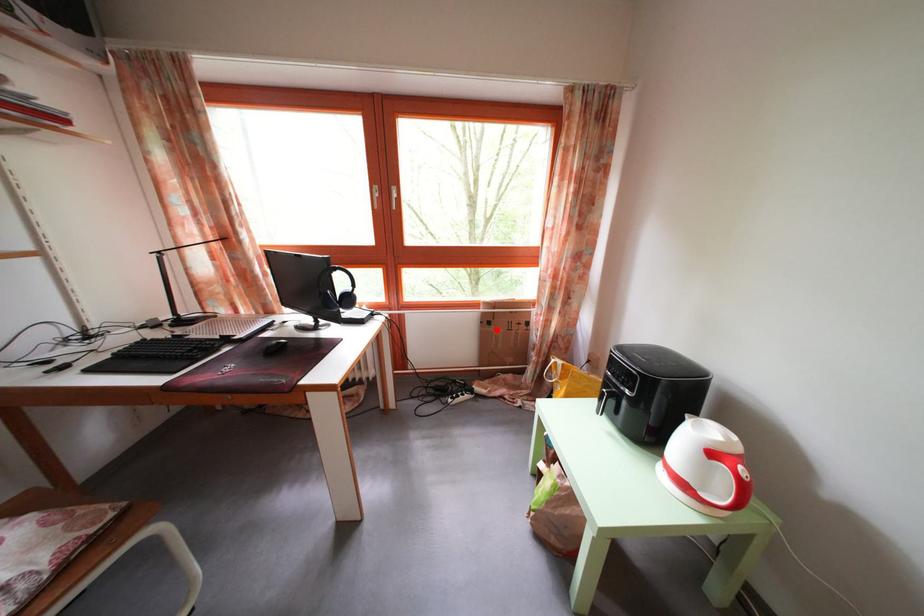
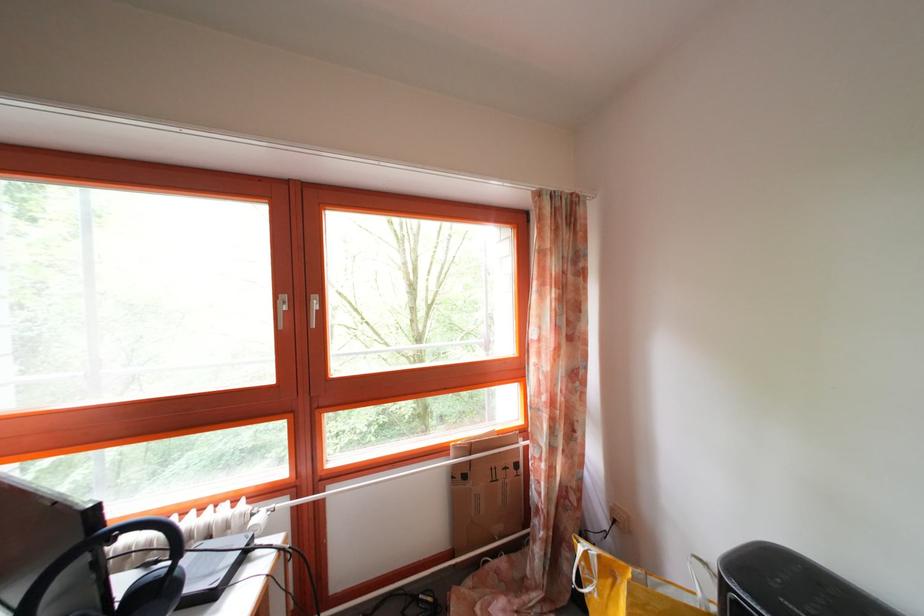
Where in the second image is the point corresponding to the highlighted location from the first image?

(472, 484)